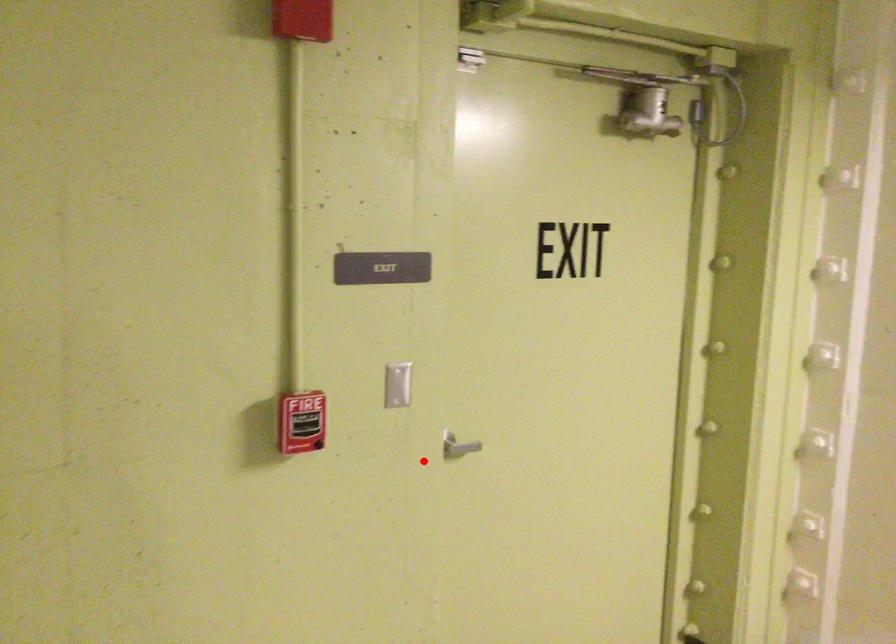
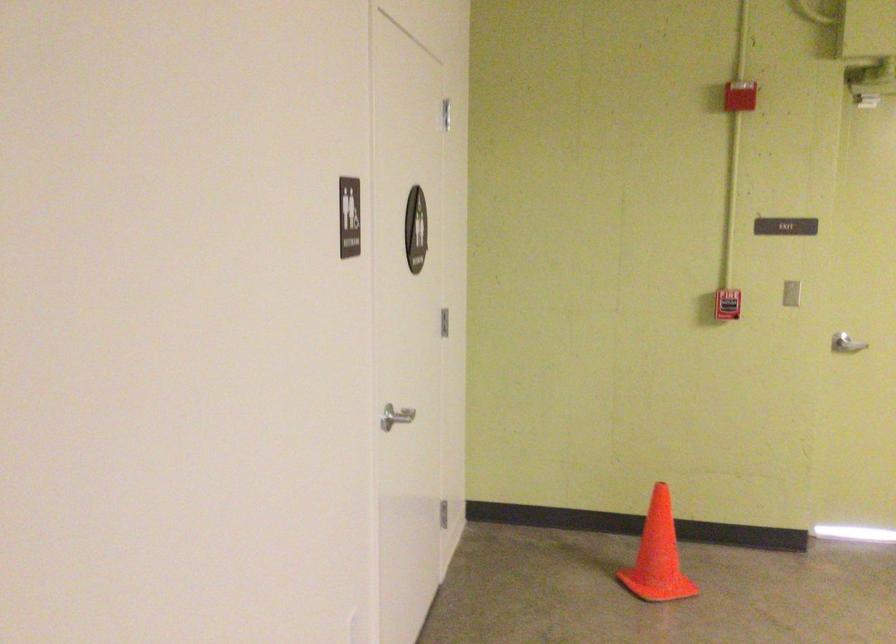
Question: I am providing you with two images of the same scene from different viewpoints. A red point is shown in image1. For the corresponding object point in image2, is it positioned nearer or farther from the camera?

Choices:
 (A) Nearer
 (B) Farther

Answer: (B)